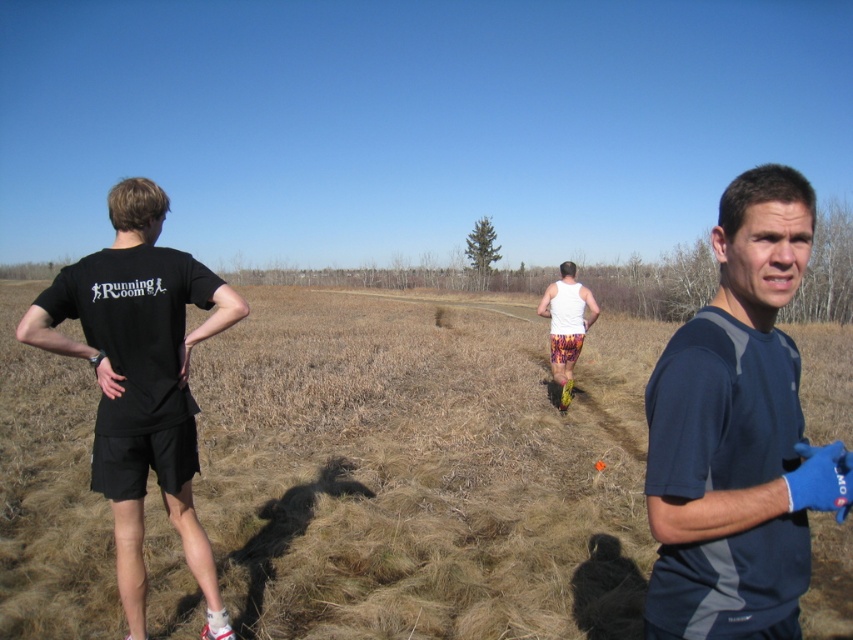
Does brown dry grass at center appear over white tank top at center?

Actually, brown dry grass at center is below white tank top at center.

Does brown dry grass at center appear under white tank top at center?

Correct, brown dry grass at center is located below white tank top at center.

What do you see at coordinates (421, 472) in the screenshot? I see `brown dry grass at center` at bounding box center [421, 472].

Identify the location of brown dry grass at center. (421, 472).

Which of these two, brown dry grass at center or black cotton t-shirt at left, stands taller?

brown dry grass at center

From the picture: Is brown dry grass at center taller than black cotton t-shirt at left?

Correct, brown dry grass at center is much taller as black cotton t-shirt at left.

Which is in front, point (816, 406) or point (216, 609)?

Point (216, 609) is more forward.

This screenshot has height=640, width=853. What are the coordinates of `brown dry grass at center` in the screenshot? It's located at (421, 472).

Is point (793, 406) positioned in front of point (555, 349)?

That is True.

Is blue fabric shirt at center closer to the viewer compared to white tank top at center?

Yes, it is in front of white tank top at center.

What are the coordinates of `blue fabric shirt at center` in the screenshot? It's located at (737, 433).